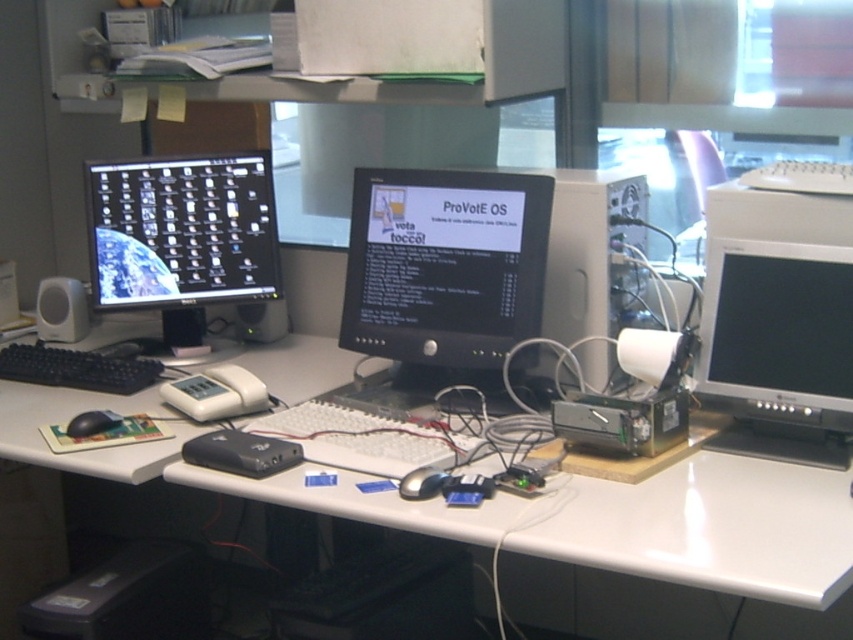
You are a delivery person who needs to place a package on the desk. The package is 1.5 meters long. Can you fit it on the desk between the point at coordinates point (663,524) and the camera? Explain your reasoning.

The distance between the point (663,524) and the camera is 1.62 meters. Since the package is 1.5 meters long, it can fit between them as the available space is slightly larger than the package length.

You are a technician who needs to connect the black glossy mouse at center to the white plastic computer desk at center. The mouse requires a 15.5 inch long cable to reach the desk. Based on the description, will the cable be long enough?

The white plastic computer desk at center and black glossy mouse at center are 15.38 inches apart from each other. Since the required cable length is 15.5 inches, which is slightly longer than the distance between them, the cable will be long enough to connect the black glossy mouse at center to the white plastic computer desk at center.